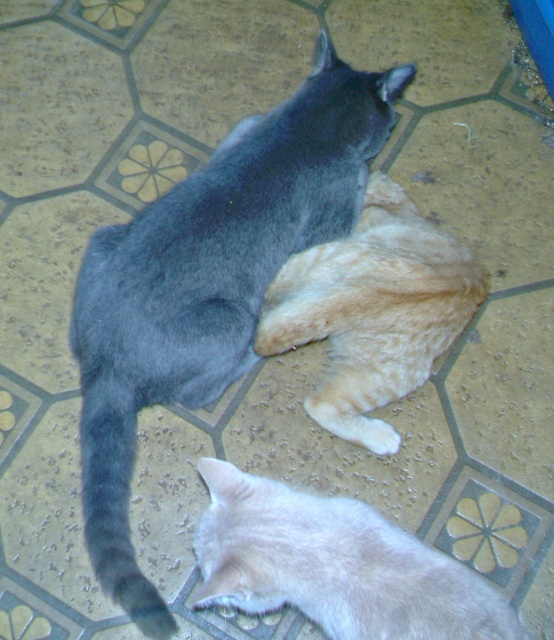
This screenshot has height=640, width=554. What are the coordinates of `gray matte cat at upper center` in the screenshot? It's located at (208, 284).

Can you confirm if gray matte cat at upper center is thinner than orange tabby cat at center?

In fact, gray matte cat at upper center might be wider than orange tabby cat at center.

Where is `gray matte cat at upper center`? gray matte cat at upper center is located at coordinates (208, 284).

Find the location of `gray matte cat at upper center`. gray matte cat at upper center is located at coordinates click(x=208, y=284).

Does gray matte cat at upper center appear under tabby fur cat at lower center?

Actually, gray matte cat at upper center is above tabby fur cat at lower center.

Is gray matte cat at upper center wider than tabby fur cat at lower center?

Yes, gray matte cat at upper center is wider than tabby fur cat at lower center.

Image resolution: width=554 pixels, height=640 pixels. Describe the element at coordinates (208, 284) in the screenshot. I see `gray matte cat at upper center` at that location.

Locate an element on the screen. Image resolution: width=554 pixels, height=640 pixels. gray matte cat at upper center is located at coordinates (208, 284).

Is tabby fur cat at lower center in front of orange tabby cat at center?

Yes, tabby fur cat at lower center is closer to the viewer.

Does tabby fur cat at lower center appear over orange tabby cat at center?

No, tabby fur cat at lower center is not above orange tabby cat at center.

What do you see at coordinates (335, 564) in the screenshot? I see `tabby fur cat at lower center` at bounding box center [335, 564].

Where is `tabby fur cat at lower center`? This screenshot has width=554, height=640. tabby fur cat at lower center is located at coordinates (335, 564).